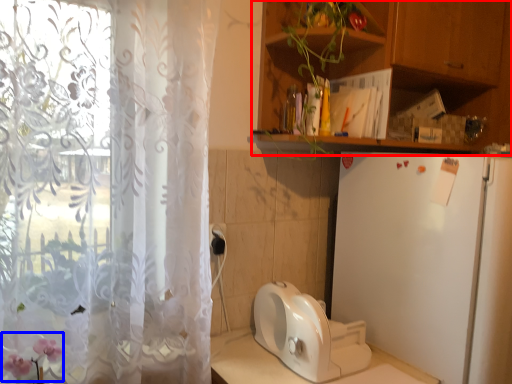
Question: Which of the following is the farthest to the observer, cabinetry (highlighted by a red box) or flower (highlighted by a blue box)?

Choices:
 (A) cabinetry
 (B) flower

Answer: (A)